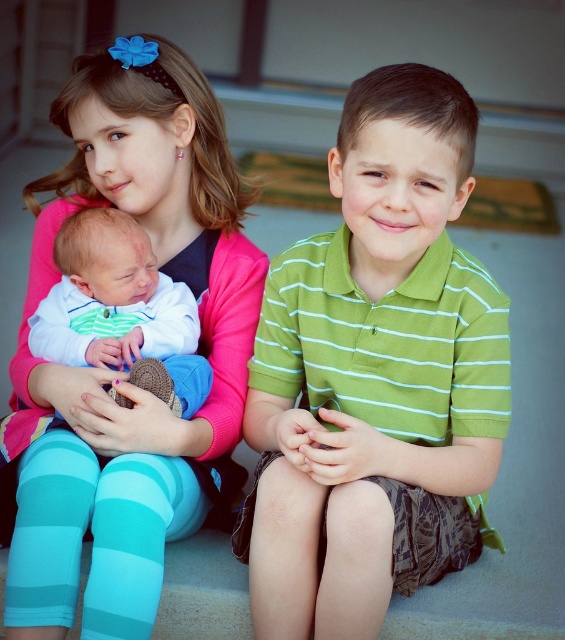
From the picture: You are standing in front of the scene and want to hand a small gift to the baby. The gift requires you to be within 1 meter to place it safely. Can you reach the baby from your current position near the pink fabric at upper left?

The pink fabric at upper left and viewer are 1.28 meters apart, so you are 1.28 meters away from the pink fabric at upper left. Since the required distance is within 1 meter, you cannot safely place the gift from your current position.

You are a clothing designer observing the image. You need to determine which garment has a greater width for a new collection. Which garment between the green striped polo shirt at center and the striped cotton onesie at lower left is wider?

→ The green striped polo shirt at center is wider than the striped cotton onesie at lower left according to the description.